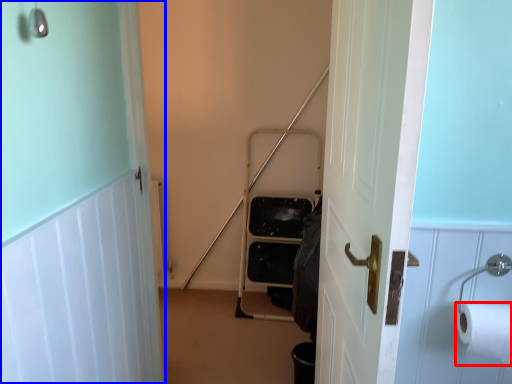
Question: Which object appears closest to the camera in this image, toilet paper (highlighted by a red box) or door (highlighted by a blue box)?

Choices:
 (A) toilet paper
 (B) door

Answer: (B)